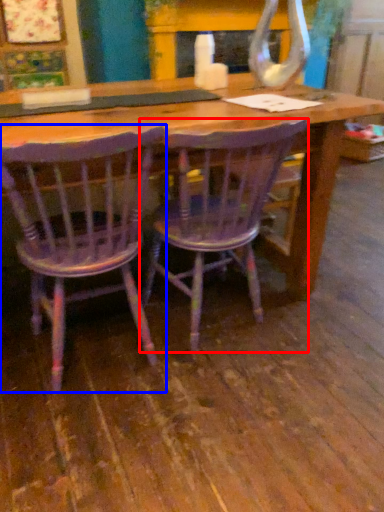
Question: Which object is closer to the camera taking this photo, chair (highlighted by a red box) or chair (highlighted by a blue box)?

Choices:
 (A) chair
 (B) chair

Answer: (B)